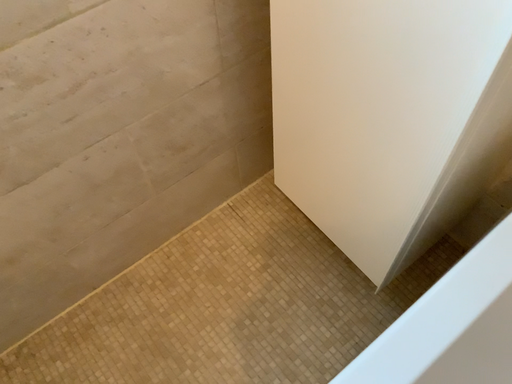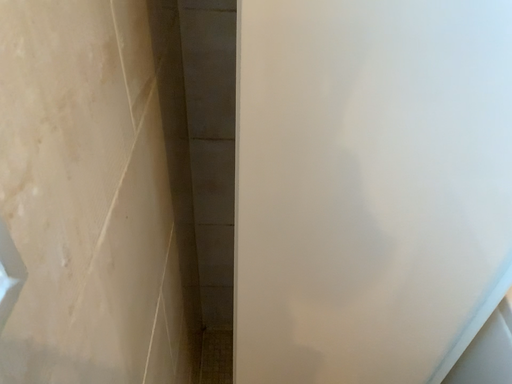
Question: Which way did the camera rotate in the video?

Choices:
 (A) rotated upward
 (B) rotated downward

Answer: (A)